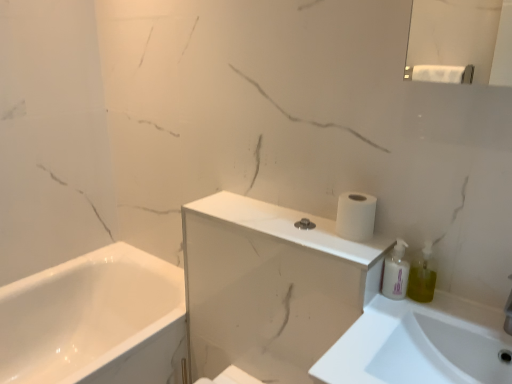
You are a GUI agent. You are given a task and a screenshot of the screen. Output one action in this format:
    pyautogui.click(x=<x>, y=<y>)
    Task: Click on the free spot in front of white matte toilet paper at upper right
    The width and height of the screenshot is (512, 384).
    Given the screenshot: What is the action you would take?
    pyautogui.click(x=349, y=246)